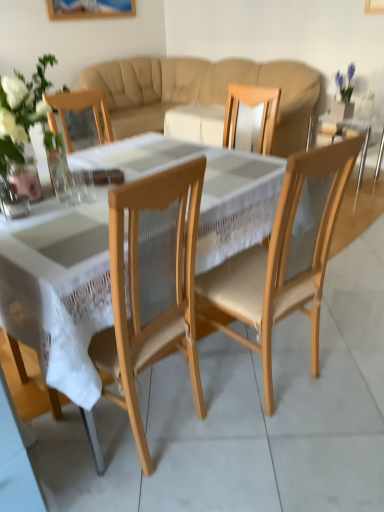
This screenshot has height=512, width=384. I want to click on space that is in front of clear glass at center, the second tableware in the right-to-left sequence, so click(59, 222).